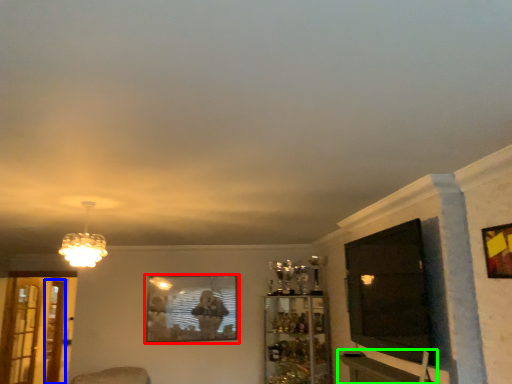
Question: Which object is positioned closest to picture frame (highlighted by a red box)? Select from screen door (highlighted by a blue box) and table (highlighted by a green box).

Choices:
 (A) screen door
 (B) table

Answer: (A)